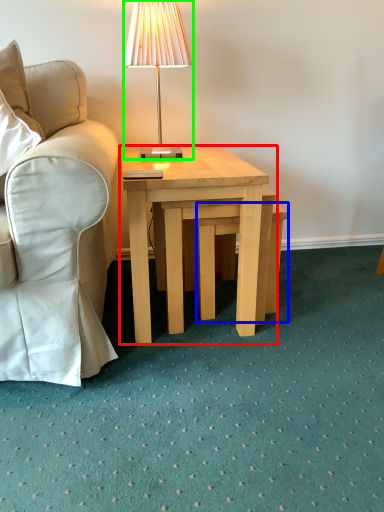
Question: Based on their relative distances, which object is farther from coffee table (highlighted by a red box)? Choose from stool (highlighted by a blue box) and lamp (highlighted by a green box).

Choices:
 (A) stool
 (B) lamp

Answer: (B)